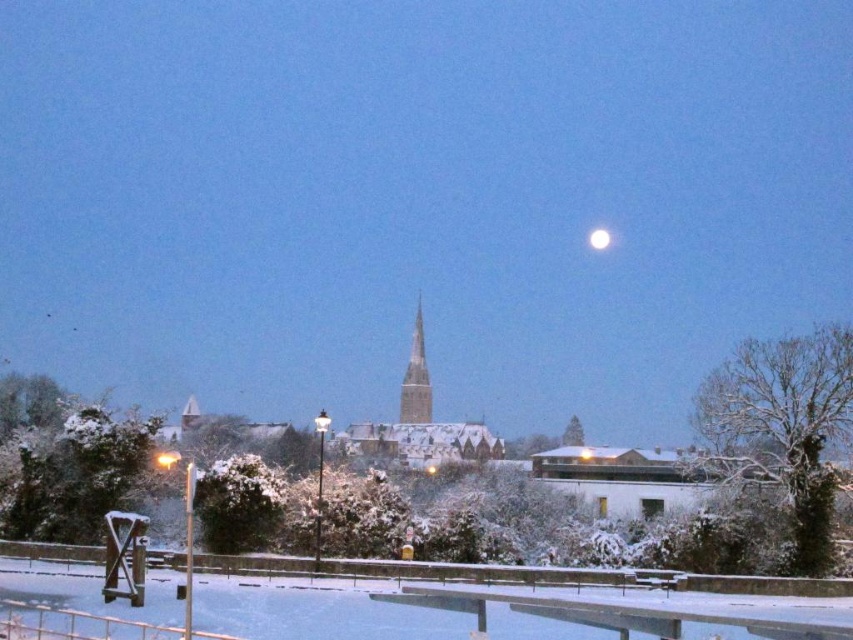
Does white snow-covered church steeple at center come in front of smooth stone spire at center?

That is False.

Is point (279, 147) closer to viewer compared to point (419, 310)?

No, it is not.

I want to click on white snow-covered church steeple at center, so click(x=421, y=198).

Can you confirm if white snow-covered church steeple at center is shorter than white glossy moon at upper center?

No.

I want to click on white snow-covered church steeple at center, so click(421, 198).

Is point (674, 360) positioned behind point (596, 237)?

Yes.

Locate an element on the screen. This screenshot has height=640, width=853. white snow-covered church steeple at center is located at coordinates (421, 198).

Does smooth stone spire at center have a lesser width compared to white glossy moon at upper center?

Incorrect, smooth stone spire at center's width is not less than white glossy moon at upper center's.

Identify the location of smooth stone spire at center. Image resolution: width=853 pixels, height=640 pixels. (416, 380).